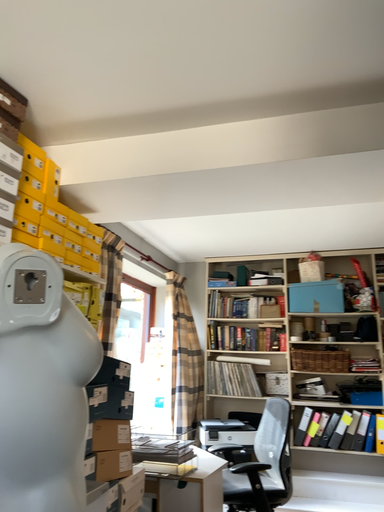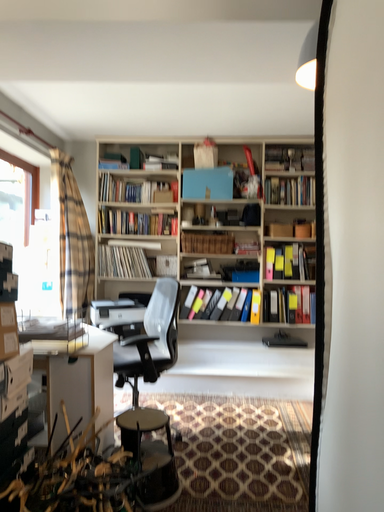
Question: How did the camera likely rotate when shooting the video?

Choices:
 (A) rotated downward
 (B) rotated upward

Answer: (A)